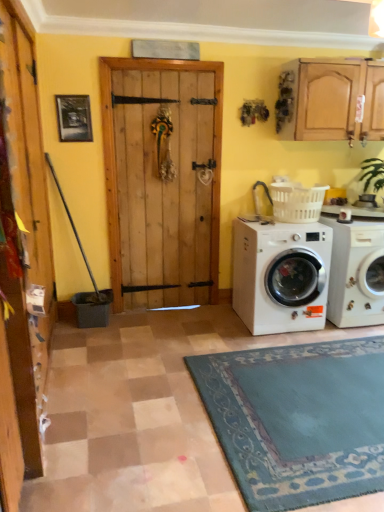
Question: Is white plastic laundry basket at right facing towards white glossy washing machine at lower right, which is the 1th washing machine in right-to-left order?

Choices:
 (A) no
 (B) yes

Answer: (A)

Question: Is white plastic laundry basket at right thinner than white glossy washing machine at lower right, which is the 1th washing machine in right-to-left order?

Choices:
 (A) no
 (B) yes

Answer: (B)

Question: Can you confirm if white plastic laundry basket at right is smaller than white glossy washing machine at lower right, the second washing machine when ordered from left to right?

Choices:
 (A) yes
 (B) no

Answer: (A)

Question: Can you confirm if white plastic laundry basket at right is shorter than white glossy washing machine at lower right, which is the 1th washing machine in right-to-left order?

Choices:
 (A) yes
 (B) no

Answer: (A)

Question: From a real-world perspective, is white plastic laundry basket at right physically below white glossy washing machine at lower right, which is the 1th washing machine in right-to-left order?

Choices:
 (A) yes
 (B) no

Answer: (B)

Question: Is white glossy washing machine at lower right, which is the 1th washing machine in right-to-left order, surrounded by white plastic laundry basket at right?

Choices:
 (A) no
 (B) yes

Answer: (A)

Question: Does white glossy washing machine at lower right, which is the 1th washing machine in right-to-left order, have a lesser height compared to white matte washing machine at lower right, which is the second washing machine in right-to-left order?

Choices:
 (A) no
 (B) yes

Answer: (A)

Question: Considering the relative positions of white glossy washing machine at lower right, the second washing machine when ordered from left to right, and white matte washing machine at lower right, marked as the 1th washing machine in a left-to-right arrangement, in the image provided, is white glossy washing machine at lower right, the second washing machine when ordered from left to right, to the left of white matte washing machine at lower right, marked as the 1th washing machine in a left-to-right arrangement, from the viewer's perspective?

Choices:
 (A) yes
 (B) no

Answer: (B)

Question: From a real-world perspective, is white glossy washing machine at lower right, the second washing machine when ordered from left to right, over white matte washing machine at lower right, which is the second washing machine in right-to-left order?

Choices:
 (A) no
 (B) yes

Answer: (A)

Question: From a real-world perspective, is white glossy washing machine at lower right, the second washing machine when ordered from left to right, physically below white matte washing machine at lower right, which is the second washing machine in right-to-left order?

Choices:
 (A) no
 (B) yes

Answer: (B)

Question: From the image's perspective, is white glossy washing machine at lower right, which is the 1th washing machine in right-to-left order, over white matte washing machine at lower right, which is the second washing machine in right-to-left order?

Choices:
 (A) yes
 (B) no

Answer: (A)

Question: Considering the relative sizes of white glossy washing machine at lower right, which is the 1th washing machine in right-to-left order, and white matte washing machine at lower right, which is the second washing machine in right-to-left order, in the image provided, is white glossy washing machine at lower right, which is the 1th washing machine in right-to-left order, bigger than white matte washing machine at lower right, which is the second washing machine in right-to-left order,?

Choices:
 (A) yes
 (B) no

Answer: (B)

Question: Is white plastic laundry basket at right outside wooden door at left?

Choices:
 (A) yes
 (B) no

Answer: (A)